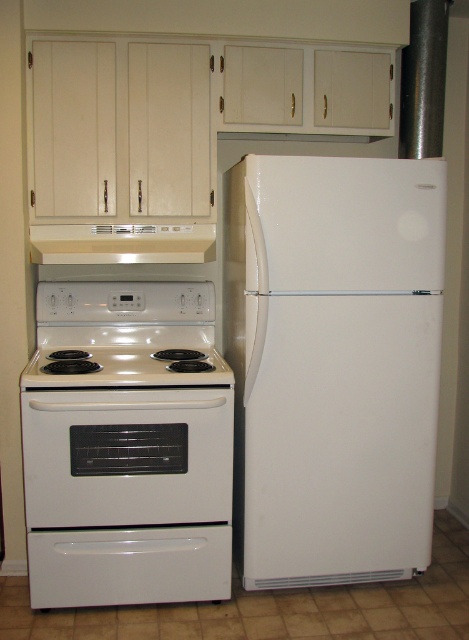
Question: Is white glossy refrigerator at center further to camera compared to white glossy electric stove at lower left?

Choices:
 (A) yes
 (B) no

Answer: (A)

Question: Which object appears closest to the camera in this image?

Choices:
 (A) white glossy refrigerator at center
 (B) white glossy electric stove at lower left

Answer: (B)

Question: Which point appears farthest from the camera in this image?

Choices:
 (A) (271, 362)
 (B) (88, 285)
 (C) (211, 252)

Answer: (B)

Question: Is the position of beige plastic exhaust hood at upper center more distant than that of white glossy electric stove at center?

Choices:
 (A) yes
 (B) no

Answer: (A)

Question: Which point is closer to the camera taking this photo?

Choices:
 (A) (204, 372)
 (B) (159, 353)
 (C) (39, 236)

Answer: (A)

Question: Is white glossy electric stove at lower left thinner than white glossy electric stove at center?

Choices:
 (A) no
 (B) yes

Answer: (A)